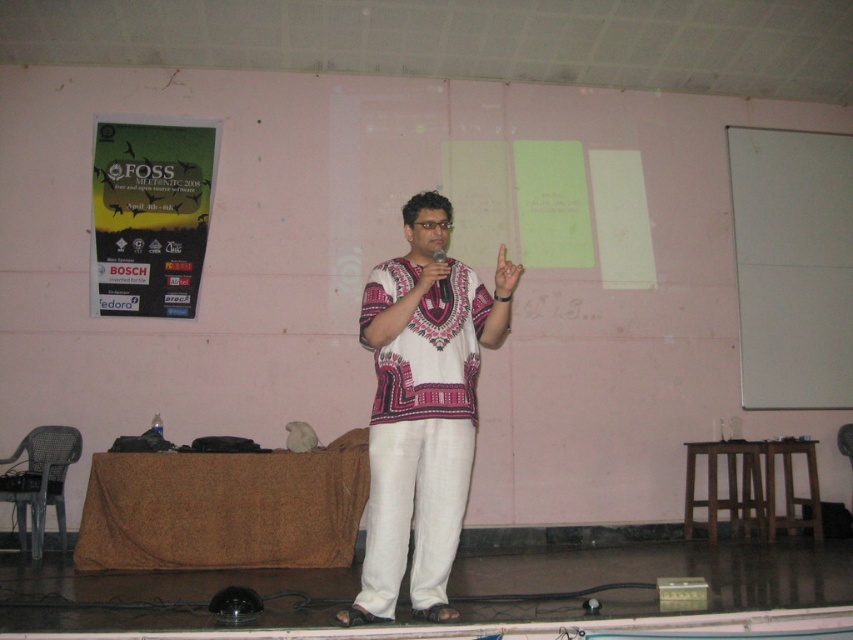
Is white cotton shirt at center positioned at the back of paper poster at left?

No, white cotton shirt at center is closer to the viewer.

What do you see at coordinates (421, 412) in the screenshot?
I see `white cotton shirt at center` at bounding box center [421, 412].

The width and height of the screenshot is (853, 640). In order to click on white cotton shirt at center in this screenshot , I will do `click(421, 412)`.

What do you see at coordinates (421, 412) in the screenshot?
I see `white cotton shirt at center` at bounding box center [421, 412].

Between white cotton shirt at center and white matte hand at center, which one appears on the left side from the viewer's perspective?

Positioned to the left is white cotton shirt at center.

Is point (392, 568) more distant than point (515, 269)?

That is True.

You are a GUI agent. You are given a task and a screenshot of the screen. Output one action in this format:
    pyautogui.click(x=<x>, y=<y>)
    Task: Click on the white cotton shirt at center
    
    Given the screenshot: What is the action you would take?
    pyautogui.click(x=421, y=412)

Is point (799, 243) less distant than point (502, 253)?

No, it is behind (502, 253).

Does white smooth board at right appear on the right side of white matte hand at center?

Correct, you'll find white smooth board at right to the right of white matte hand at center.

You are a GUI agent. You are given a task and a screenshot of the screen. Output one action in this format:
    pyautogui.click(x=<x>, y=<y>)
    Task: Click on the white smooth board at right
    
    Given the screenshot: What is the action you would take?
    (x=792, y=266)

Where is `white smooth board at right`? This screenshot has width=853, height=640. white smooth board at right is located at coordinates (792, 266).